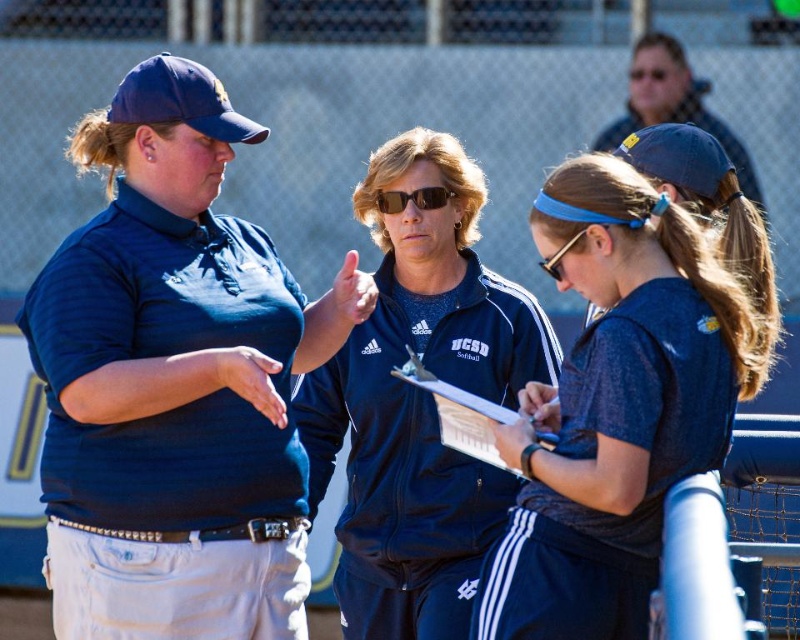
Question: Does matte blue cap at upper center have a lesser width compared to matte plastic clipboard at center?

Choices:
 (A) yes
 (B) no

Answer: (B)

Question: Does navy blue track suit at center have a greater width compared to sunglasses at center?

Choices:
 (A) yes
 (B) no

Answer: (A)

Question: Which object is the closest to the matte blue shirt at left?

Choices:
 (A) sunglasses at center
 (B) navy blue track suit at center
 (C) matte plastic clipboard at center
 (D) matte blue cap at upper center

Answer: (B)

Question: Which object is the closest to the matte blue cap at upper center?

Choices:
 (A) matte plastic clipboard at center
 (B) blue fabric headband at center

Answer: (A)

Question: Among these objects, which one is farthest from the camera?

Choices:
 (A) blue fabric headband at center
 (B) matte blue cap at upper center
 (C) matte plastic clipboard at center

Answer: (B)

Question: Is matte blue cap at upper center to the right of sunglasses at center from the viewer's perspective?

Choices:
 (A) yes
 (B) no

Answer: (A)